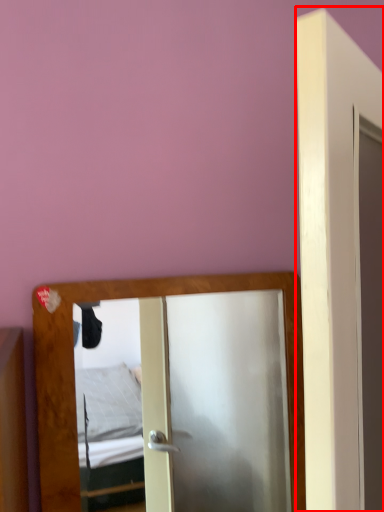
Question: Considering the relative positions of door (annotated by the red box) and mirror in the image provided, where is door (annotated by the red box) located with respect to the staircase?

Choices:
 (A) right
 (B) left

Answer: (A)